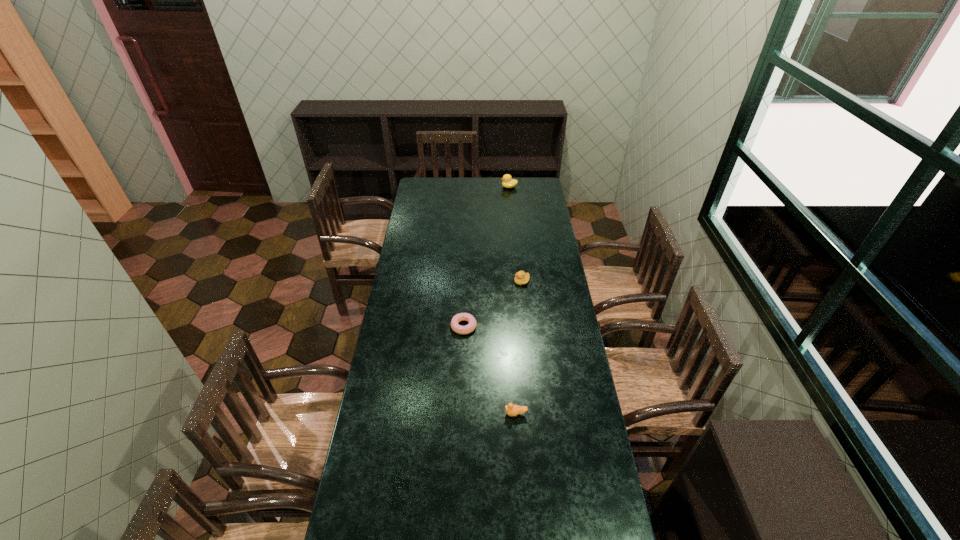
Where is `the tallest object`? This screenshot has height=540, width=960. the tallest object is located at coordinates (508, 182).

Find the location of a particular element. This screenshot has height=540, width=960. the tallest duckling is located at coordinates (508, 182).

Locate an element on the screen. the third nearest object is located at coordinates (521, 278).

The height and width of the screenshot is (540, 960). What are the coordinates of `the nearest duckling` in the screenshot? It's located at (512, 410).

This screenshot has height=540, width=960. What are the coordinates of `the third farthest object` in the screenshot? It's located at (469, 328).

Image resolution: width=960 pixels, height=540 pixels. Find the location of `the leftmost object`. the leftmost object is located at coordinates (469, 328).

Identify the location of free space located 0.050m on the beak of the tallest object. The height and width of the screenshot is (540, 960). (492, 187).

Locate an element on the screen. vacant space situated on the beak of the tallest object is located at coordinates (452, 187).

This screenshot has height=540, width=960. Identify the location of free spot located 0.310m on the beak of the tallest object. click(x=452, y=187).

Find the location of a particular element. blank space located on the beak of the second nearest duckling is located at coordinates (451, 281).